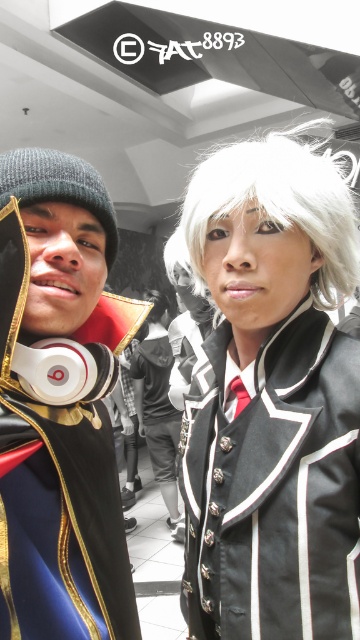
Question: Which of these objects is positioned farthest from the matte black hoodie at left?

Choices:
 (A) white silky wig at upper right
 (B) black leather jacket at upper right

Answer: (A)

Question: Estimate the real-world distances between objects in this image. Which object is farther from the white silky wig at upper right?

Choices:
 (A) matte black hoodie at left
 (B) black leather jacket at upper right

Answer: (A)

Question: In this image, where is black leather jacket at upper right located relative to white silky wig at upper right?

Choices:
 (A) right
 (B) left

Answer: (B)

Question: Does satin black wig at upper right lie in front of white matte wig at upper center?

Choices:
 (A) no
 (B) yes

Answer: (B)

Question: Which point is farther to the camera?

Choices:
 (A) matte black hoodie at left
 (B) black leather jacket at upper right
 (C) white matte wig at upper center

Answer: (C)

Question: Is matte black hoodie at left further to the viewer compared to satin black wig at upper right?

Choices:
 (A) no
 (B) yes

Answer: (A)